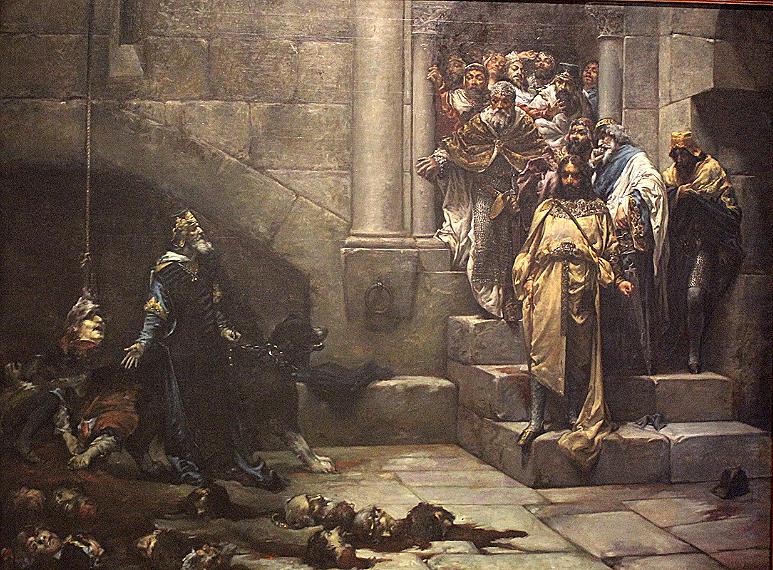
Where is `dungeon floor`? The height and width of the screenshot is (570, 773). dungeon floor is located at coordinates (587, 523).